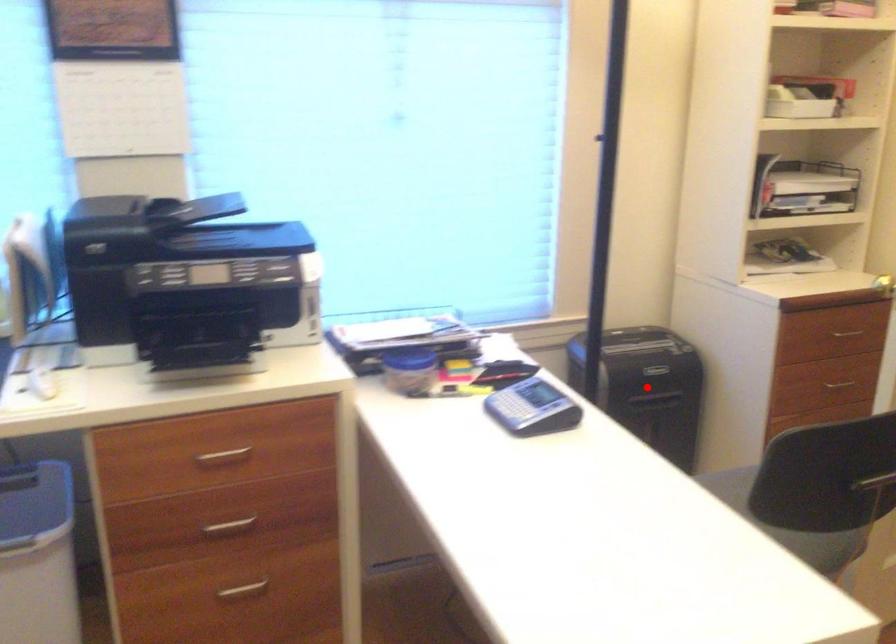
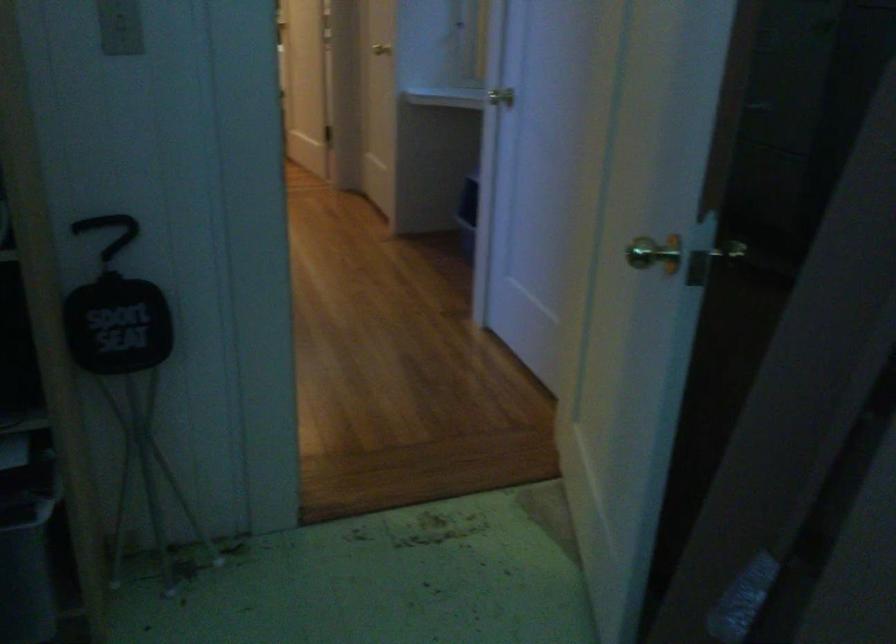
Question: I am providing you with two images of the same scene from different viewpoints. A red point is marked on the first image. Can you still see the location of the red point in image 2?

Choices:
 (A) Yes
 (B) No

Answer: (B)